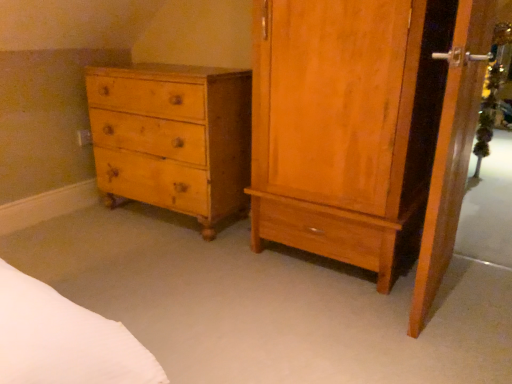
Locate an element on the screen. The height and width of the screenshot is (384, 512). vacant space underneath yellow wood chest of drawers at left (from a real-world perspective) is located at coordinates (161, 224).